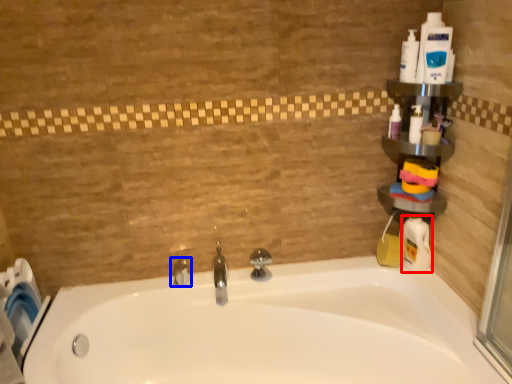
Question: Which object is closer to the camera taking this photo, cleaning product (highlighted by a red box) or tap (highlighted by a blue box)?

Choices:
 (A) cleaning product
 (B) tap

Answer: (A)